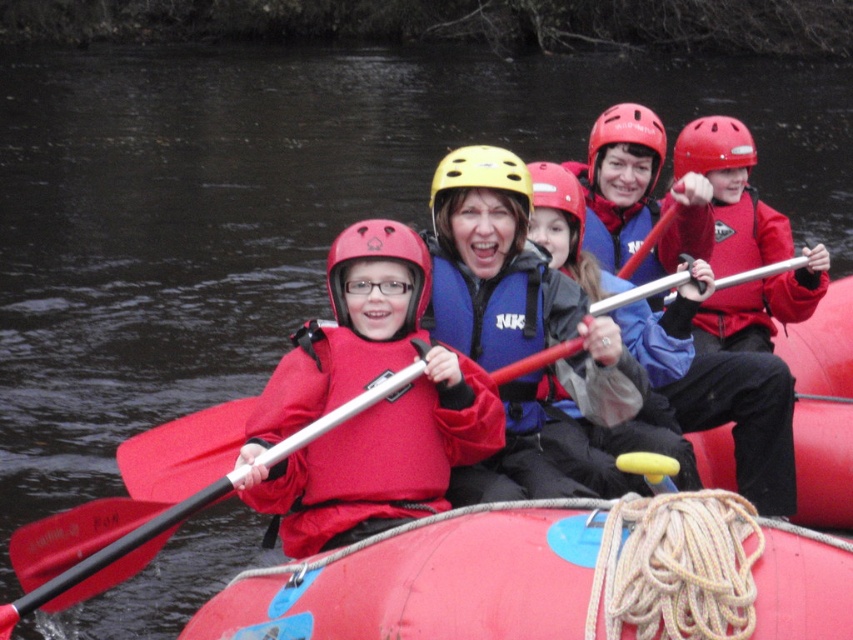
Question: Does blue/textured life jacket at center appear over red matte helmet at upper right?

Choices:
 (A) no
 (B) yes

Answer: (A)

Question: Based on their relative distances, which object is nearer to the blue nylon life vest at center?

Choices:
 (A) matte yellow helmet at center
 (B) matte white paddle at center
 (C) red matte helmet at center
 (D) yellow matte helmet at center

Answer: (D)

Question: Is matte red life vest at center further to the viewer compared to matte blue jacket at center?

Choices:
 (A) yes
 (B) no

Answer: (B)

Question: Considering the real-world distances, which object is farthest from the matte white paddle at center?

Choices:
 (A) red matte helmet at center
 (B) red rubber raft at center
 (C) red matte helmet at upper right

Answer: (A)

Question: Estimate the real-world distances between objects in this image. Which object is closer to the matte blue jacket at center?

Choices:
 (A) matte red helmet at center
 (B) matte yellow helmet at center
 (C) red rubber raft at center

Answer: (B)

Question: Does blue nylon life vest at center have a greater width compared to matte yellow helmet at center?

Choices:
 (A) no
 (B) yes

Answer: (B)